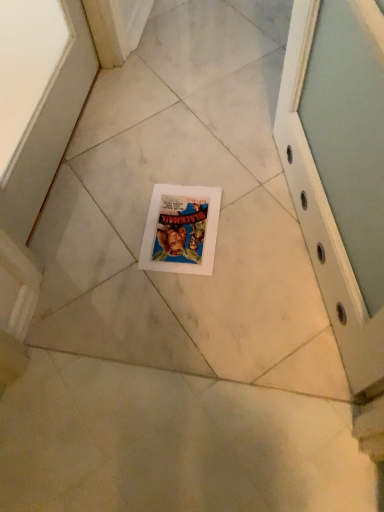
Locate an element on the screen. vacant space to the left of white paper comic book at center is located at coordinates (102, 237).